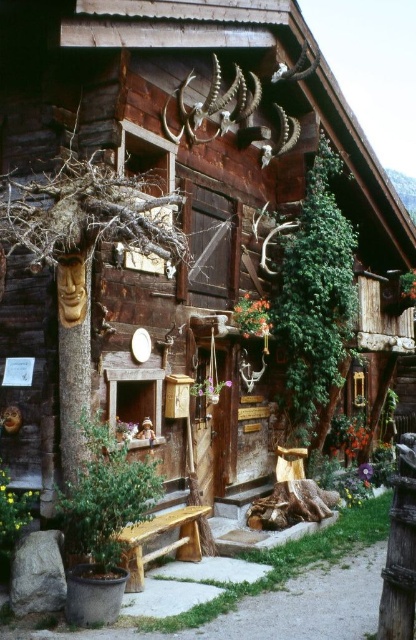
Question: Estimate the real-world distances between objects in this image. Which object is farther from the green leafy plant at right?

Choices:
 (A) brown wood tree trunk at left
 (B) natural wood bench at center

Answer: (A)

Question: From the image, what is the correct spatial relationship of brown wood tree trunk at left in relation to natural wood bench at center?

Choices:
 (A) below
 (B) above

Answer: (B)

Question: Which is farther from the green leafy plant at right?

Choices:
 (A) brown wood tree trunk at left
 (B) natural wood bench at center

Answer: (A)

Question: Based on their relative distances, which object is farther from the brown wood tree trunk at left?

Choices:
 (A) green leafy plant at right
 (B) natural wood bench at center

Answer: (A)

Question: Does brown wood tree trunk at left have a greater width compared to natural wood bench at center?

Choices:
 (A) no
 (B) yes

Answer: (B)

Question: Can you confirm if brown wood tree trunk at left is thinner than natural wood bench at center?

Choices:
 (A) yes
 (B) no

Answer: (B)